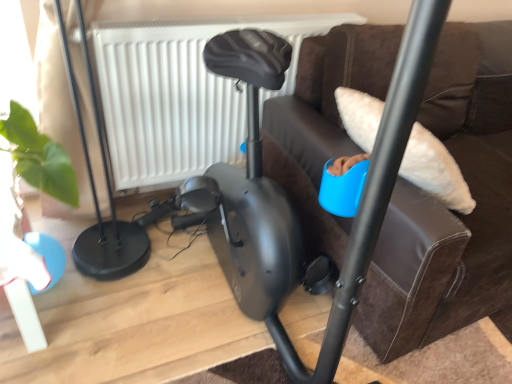
Question: Considering their positions, is black matte exercise bike at center located in front of or behind white textured radiator at upper center?

Choices:
 (A) front
 (B) behind

Answer: (A)

Question: Does point (465, 137) appear closer or farther from the camera than point (166, 117)?

Choices:
 (A) farther
 (B) closer

Answer: (A)

Question: From the image's perspective, relative to white textured radiator at upper center, is black matte exercise bike at center above or below?

Choices:
 (A) below
 (B) above

Answer: (A)

Question: From the image's perspective, is white textured radiator at upper center positioned above or below black matte exercise bike at center?

Choices:
 (A) above
 (B) below

Answer: (A)

Question: Is white textured radiator at upper center in front of or behind black matte exercise bike at center in the image?

Choices:
 (A) behind
 (B) front

Answer: (A)

Question: From a real-world perspective, is white textured radiator at upper center physically located above or below black matte exercise bike at center?

Choices:
 (A) above
 (B) below

Answer: (B)

Question: In the image, is white textured radiator at upper center on the left side or the right side of black matte exercise bike at center?

Choices:
 (A) right
 (B) left

Answer: (B)